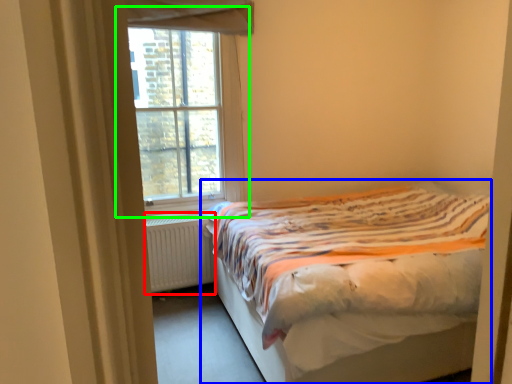
Question: Which object is the farthest from radiator (highlighted by a red box)? Choose among these: bed (highlighted by a blue box) or window (highlighted by a green box).

Choices:
 (A) bed
 (B) window

Answer: (A)